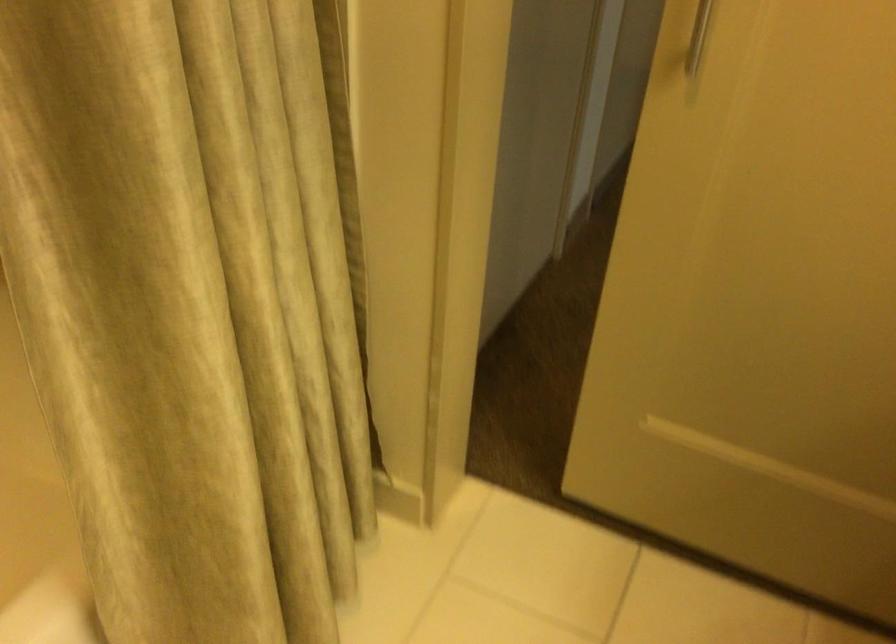
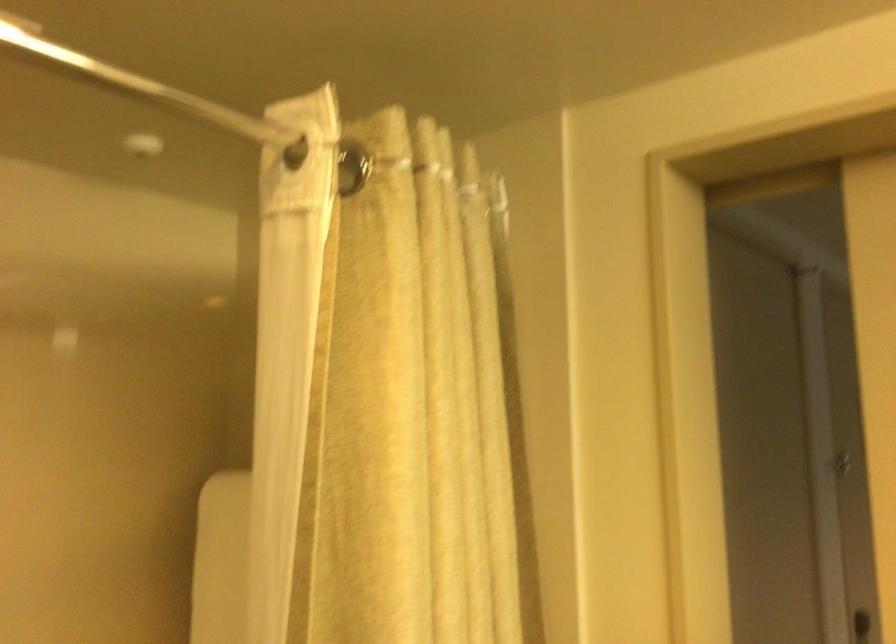
How did the camera likely rotate?

The rotation direction of the camera is left-up.